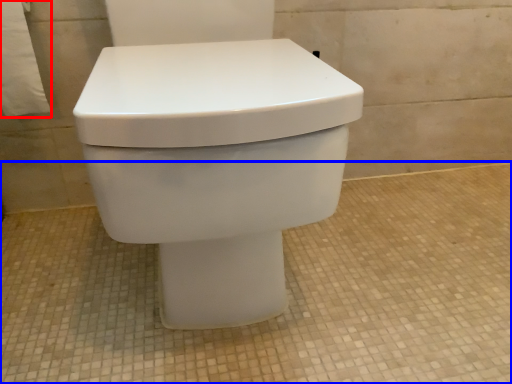
Question: Among these objects, which one is nearest to the camera, toilet paper (highlighted by a red box) or concrete (highlighted by a blue box)?

Choices:
 (A) toilet paper
 (B) concrete

Answer: (B)